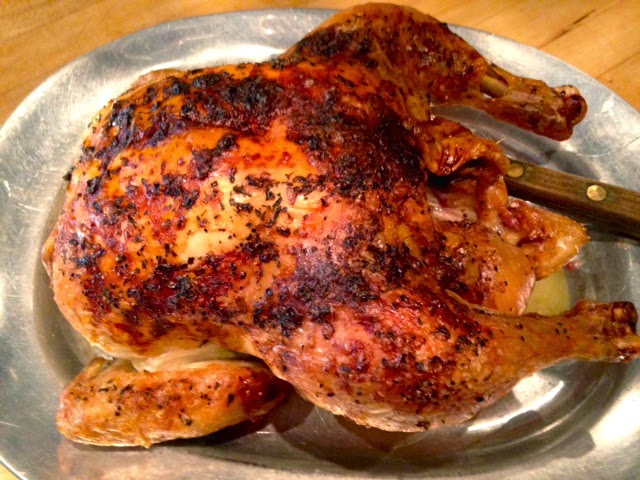
This screenshot has height=480, width=640. I want to click on table surface, so click(x=621, y=13).